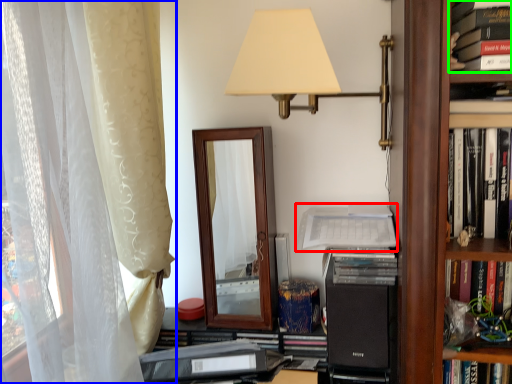
Question: Which object is the closest to the paperback book (highlighted by a red box)? Choose among these: curtain (highlighted by a blue box) or book (highlighted by a green box).

Choices:
 (A) curtain
 (B) book

Answer: (B)